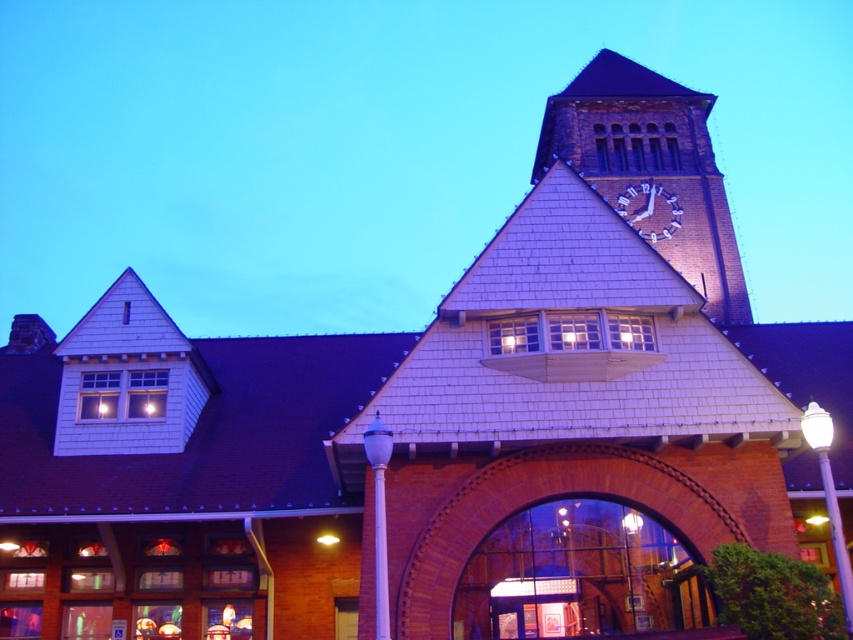
Question: Which point is farther to the camera?

Choices:
 (A) metallic silver clock at upper right
 (B) brick clock tower at upper center

Answer: (A)

Question: Can you confirm if brick clock tower at upper center is positioned to the right of metallic silver clock at upper right?

Choices:
 (A) yes
 (B) no

Answer: (B)

Question: Which point is closer to the camera?

Choices:
 (A) brick clock tower at upper center
 (B) metallic silver clock at upper right

Answer: (A)

Question: Can you confirm if brick clock tower at upper center is bigger than metallic silver clock at upper right?

Choices:
 (A) no
 (B) yes

Answer: (B)

Question: Which point appears farthest from the camera in this image?

Choices:
 (A) (625, 218)
 (B) (660, 182)

Answer: (B)

Question: Is brick clock tower at upper center bigger than metallic silver clock at upper right?

Choices:
 (A) yes
 (B) no

Answer: (A)